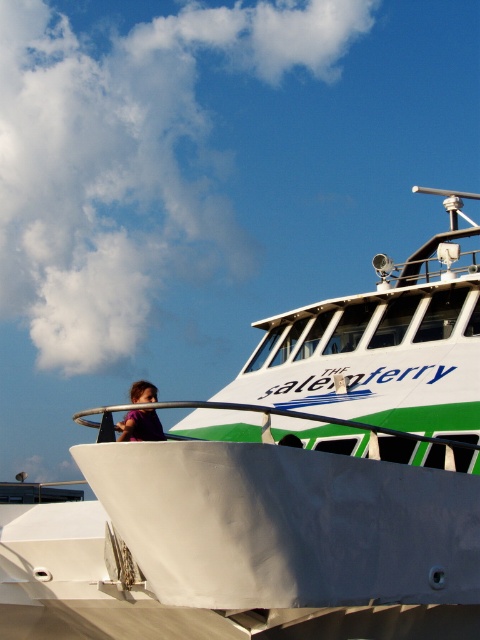
Is the position of white matte ferry at center less distant than that of purple fabric at upper left?

Yes, it is.

Can you confirm if white matte ferry at center is smaller than purple fabric at upper left?

Actually, white matte ferry at center might be larger than purple fabric at upper left.

The width and height of the screenshot is (480, 640). Identify the location of white matte ferry at center. (285, 484).